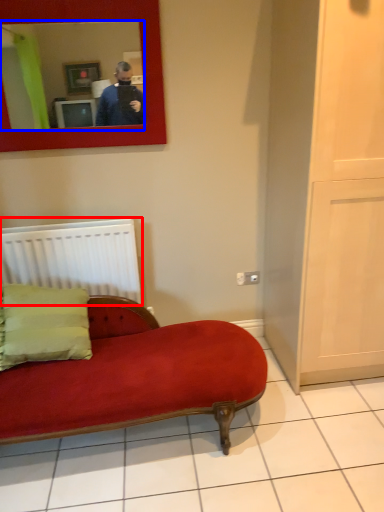
Question: Which object is closer to the camera taking this photo, radiator (highlighted by a red box) or mirror (highlighted by a blue box)?

Choices:
 (A) radiator
 (B) mirror

Answer: (B)